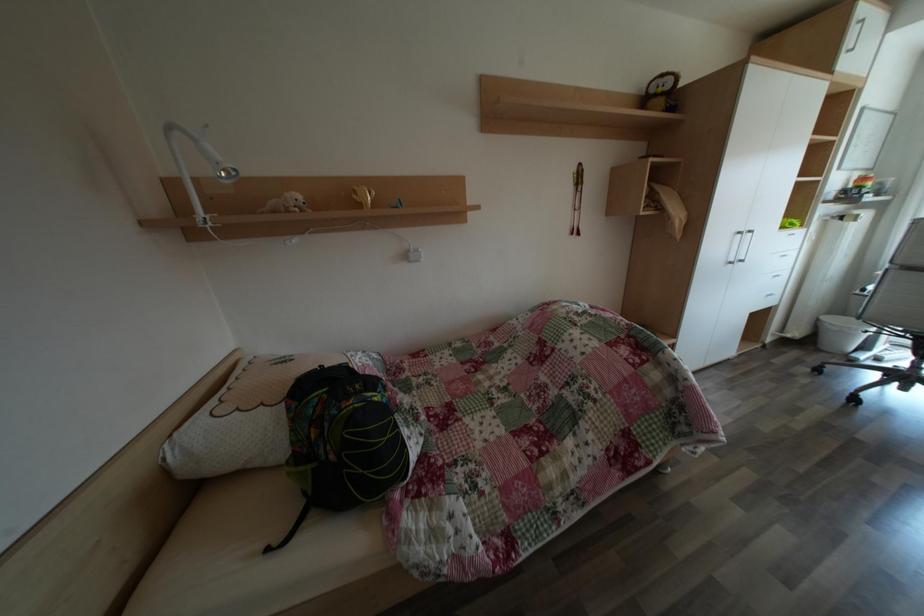
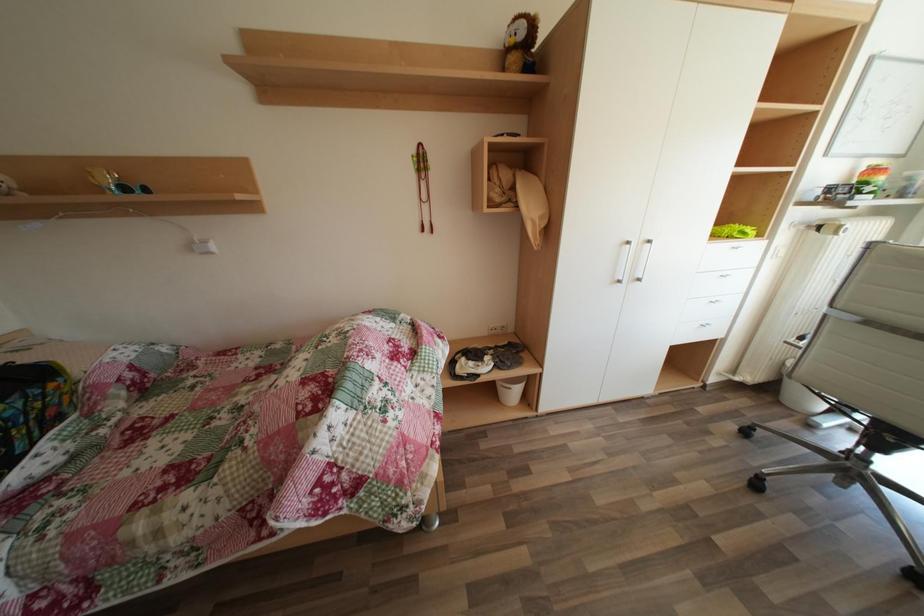
Question: Which direction would the cameraman need to move to produce the second image? Reply with the corresponding letter.

Choices:
 (A) Left
 (B) Right
 (C) Forward
 (D) Backward

Answer: (B)